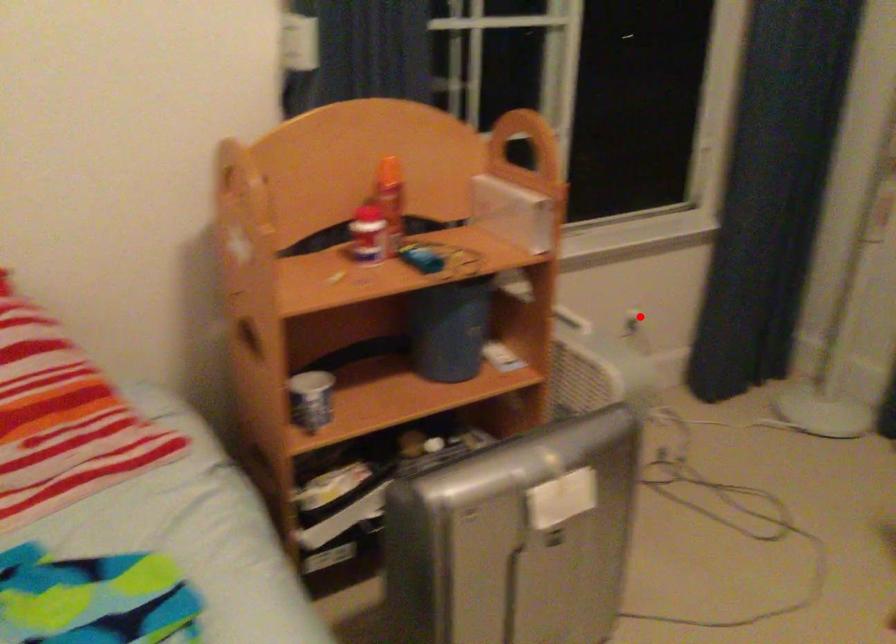
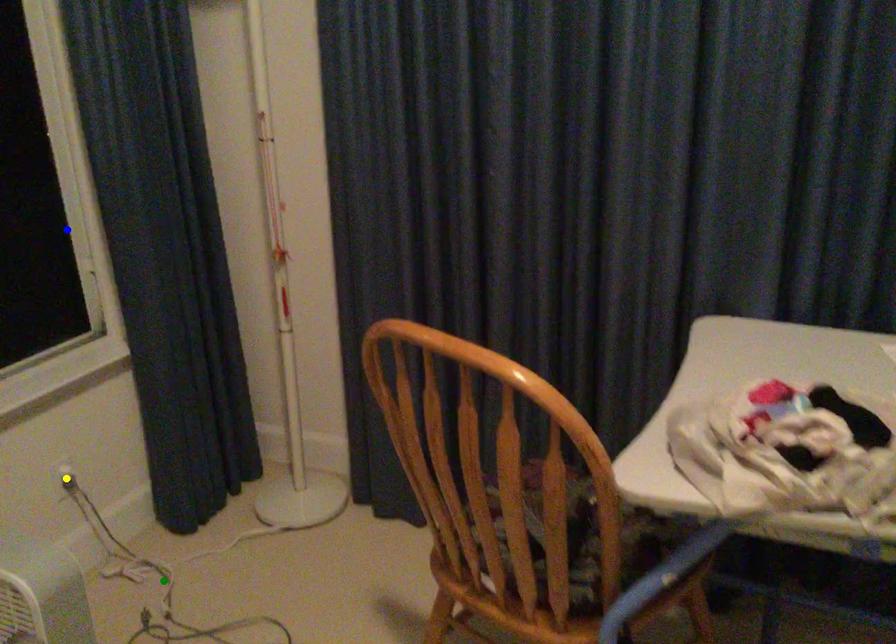
Question: I am providing you with two images of the same scene from different viewpoints. A red point is marked on the first image. You are given multiple points on the second image. Can you choose the point in image 2 that corresponds to the point in image 1?

Choices:
 (A) blue point
 (B) yellow point
 (C) green point

Answer: (B)